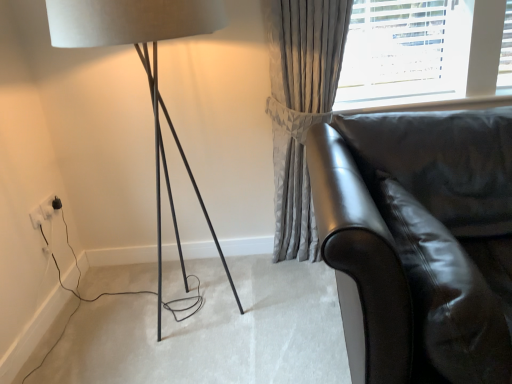
Where is `vacant space positioned to the left of matte black lamp at left`? The height and width of the screenshot is (384, 512). vacant space positioned to the left of matte black lamp at left is located at coordinates (99, 322).